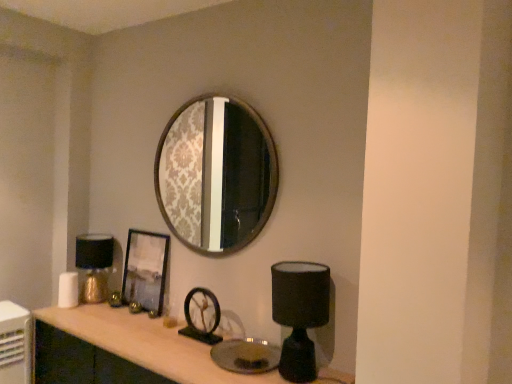
Locate an element on the screen. The image size is (512, 384). vacant space underneath wooden frame mirror at upper center (from a real-world perspective) is located at coordinates (192, 324).